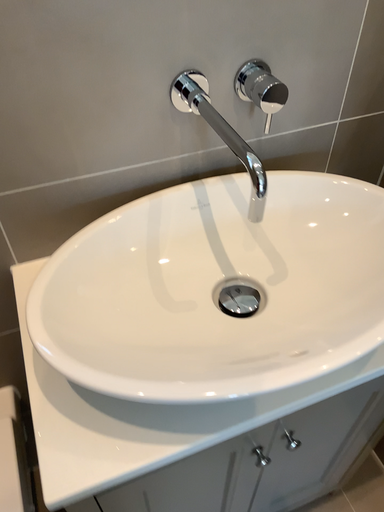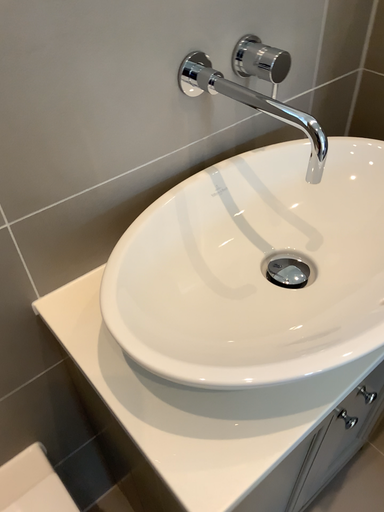
Question: How did the camera likely rotate when shooting the video?

Choices:
 (A) rotated right
 (B) rotated left

Answer: (A)